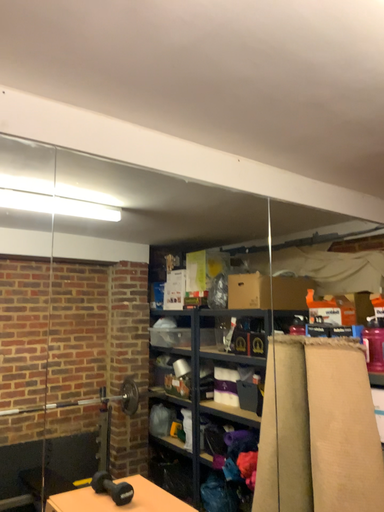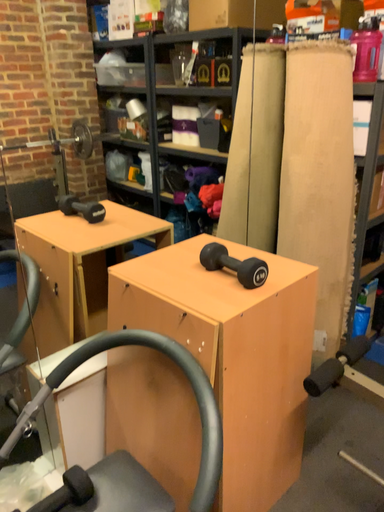
Question: Which way did the camera rotate in the video?

Choices:
 (A) rotated right
 (B) rotated left

Answer: (A)